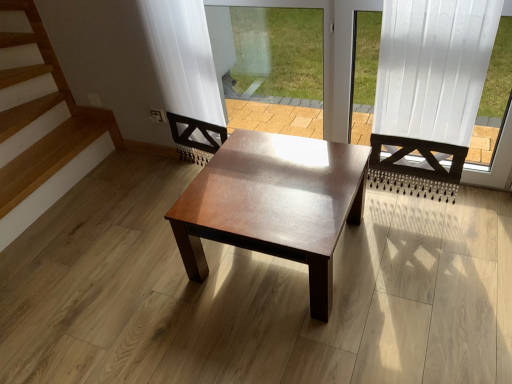
This screenshot has width=512, height=384. In order to click on vacant region in front of shiny brown wood coffee table at center in this screenshot , I will do `click(312, 342)`.